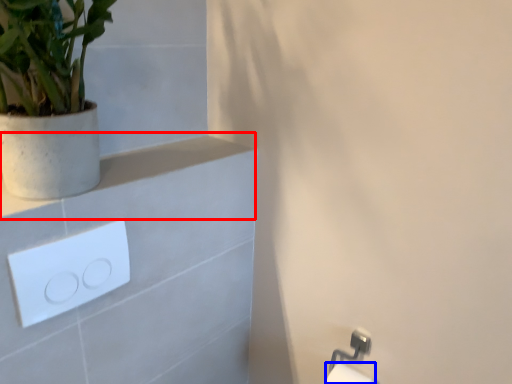
Question: Which point is closer to the camera, balustrade (highlighted by a red box) or toilet paper (highlighted by a blue box)?

Choices:
 (A) balustrade
 (B) toilet paper

Answer: (A)